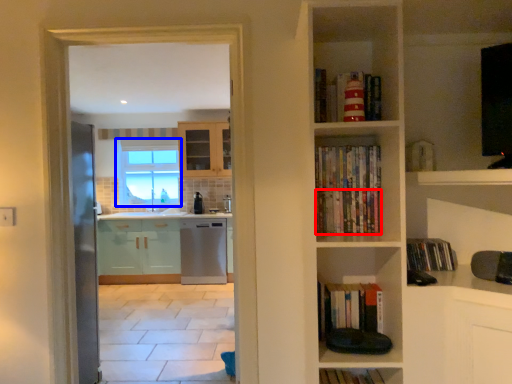
Question: Which object is further to the camera taking this photo, book (highlighted by a red box) or window (highlighted by a blue box)?

Choices:
 (A) book
 (B) window

Answer: (B)